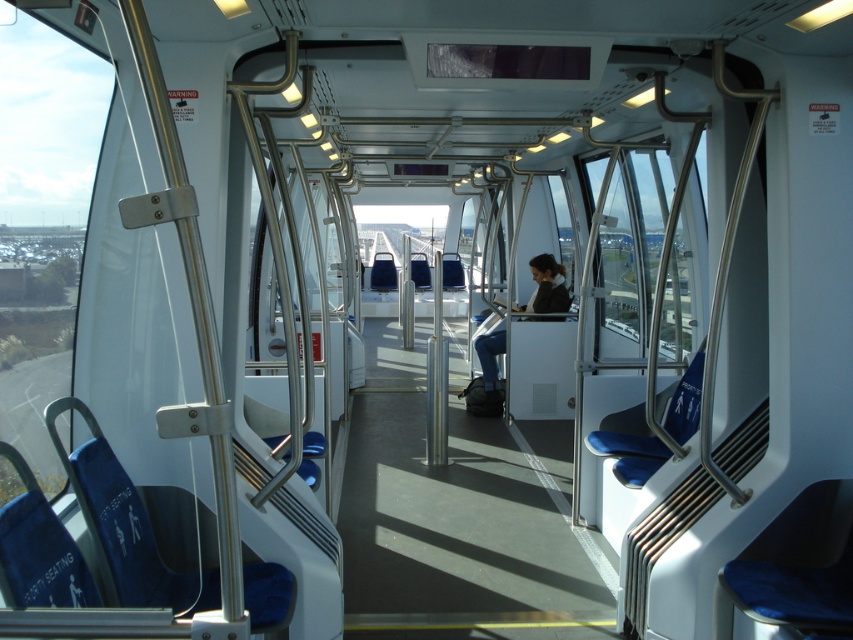
Is point (44, 385) positioned in front of point (552, 272)?

Yes, it is.

Locate an element on the screen. transparent glass window at left is located at coordinates (42, 218).

Can you confirm if clear glass window at center is positioned to the right of dark blue jeans at center?

Indeed, clear glass window at center is positioned on the right side of dark blue jeans at center.

Is point (672, 307) behind point (511, 307)?

No, it is in front of (511, 307).

The height and width of the screenshot is (640, 853). I want to click on clear glass window at center, so click(631, 243).

Between transparent glass window at left and clear glass window at center, which one is positioned lower?

transparent glass window at left

Is point (12, 253) positioned before point (640, 305)?

Yes.

The height and width of the screenshot is (640, 853). Describe the element at coordinates (42, 218) in the screenshot. I see `transparent glass window at left` at that location.

The width and height of the screenshot is (853, 640). I want to click on transparent glass window at left, so click(42, 218).